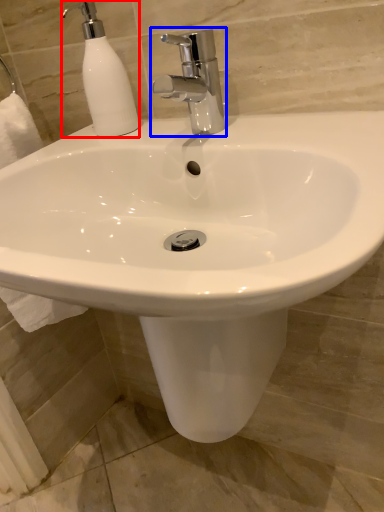
Question: Which object appears closest to the camera in this image, soap dispenser (highlighted by a red box) or tap (highlighted by a blue box)?

Choices:
 (A) soap dispenser
 (B) tap

Answer: (B)